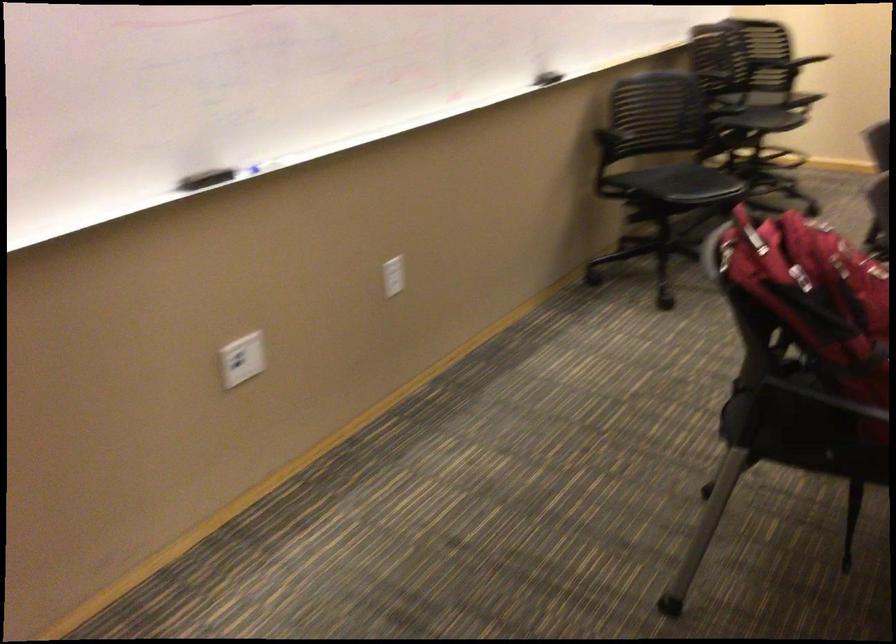
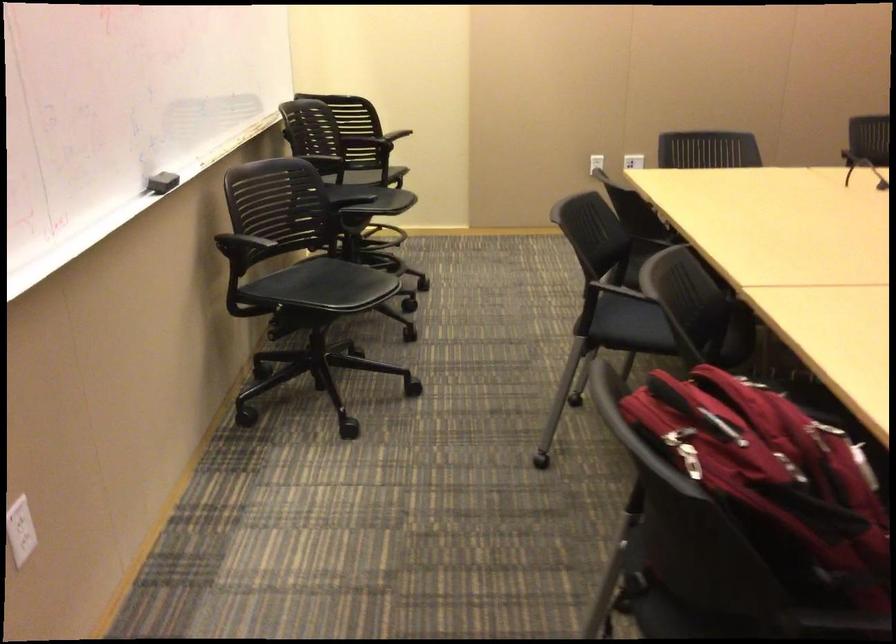
The point at (545, 75) is marked in the first image. Where is the corresponding point in the second image?

(161, 182)